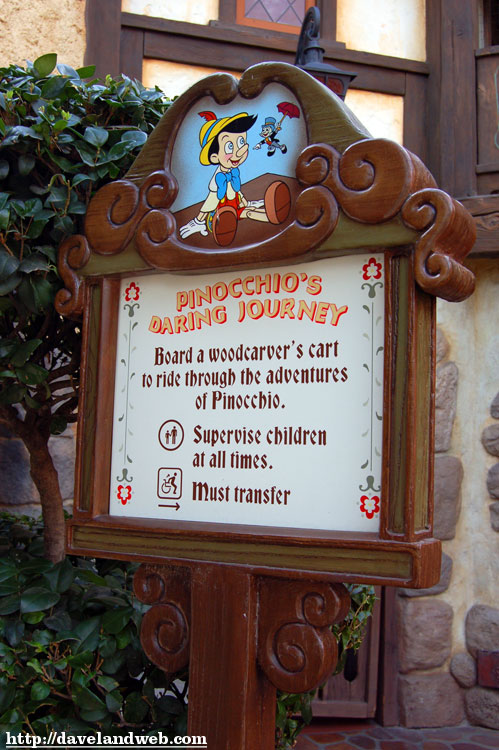
This screenshot has width=499, height=750. Identify the location of bottom of wooden door. (341, 690).